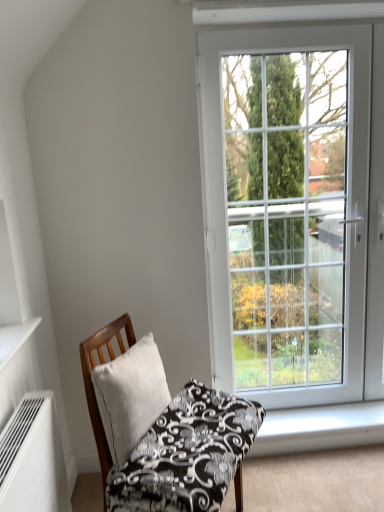
Question: From the image's perspective, is wooden chair with patterned cushion at lower left on white matte air conditioner at lower left?

Choices:
 (A) yes
 (B) no

Answer: (A)

Question: Does wooden chair with patterned cushion at lower left have a lesser height compared to white matte air conditioner at lower left?

Choices:
 (A) no
 (B) yes

Answer: (A)

Question: Considering the relative positions of wooden chair with patterned cushion at lower left and white matte air conditioner at lower left in the image provided, is wooden chair with patterned cushion at lower left behind white matte air conditioner at lower left?

Choices:
 (A) no
 (B) yes

Answer: (B)

Question: From a real-world perspective, is wooden chair with patterned cushion at lower left located beneath white matte air conditioner at lower left?

Choices:
 (A) yes
 (B) no

Answer: (A)

Question: Can you confirm if wooden chair with patterned cushion at lower left is bigger than white matte air conditioner at lower left?

Choices:
 (A) no
 (B) yes

Answer: (B)

Question: Is white matte air conditioner at lower left located within wooden chair with patterned cushion at lower left?

Choices:
 (A) yes
 (B) no

Answer: (B)

Question: Could you tell me if white smooth window sill at lower right is turned towards white matte air conditioner at lower left?

Choices:
 (A) no
 (B) yes

Answer: (A)

Question: Is white smooth window sill at lower right outside white matte air conditioner at lower left?

Choices:
 (A) yes
 (B) no

Answer: (A)

Question: Is white smooth window sill at lower right oriented away from white matte air conditioner at lower left?

Choices:
 (A) no
 (B) yes

Answer: (A)

Question: Is white smooth window sill at lower right at the right side of white matte air conditioner at lower left?

Choices:
 (A) no
 (B) yes

Answer: (B)

Question: Is white smooth window sill at lower right bigger than white matte air conditioner at lower left?

Choices:
 (A) no
 (B) yes

Answer: (A)

Question: Considering the relative sizes of white smooth window sill at lower right and white matte air conditioner at lower left in the image provided, is white smooth window sill at lower right shorter than white matte air conditioner at lower left?

Choices:
 (A) yes
 (B) no

Answer: (A)

Question: Is white linen pillow at center positioned with its back to white matte air conditioner at lower left?

Choices:
 (A) yes
 (B) no

Answer: (B)